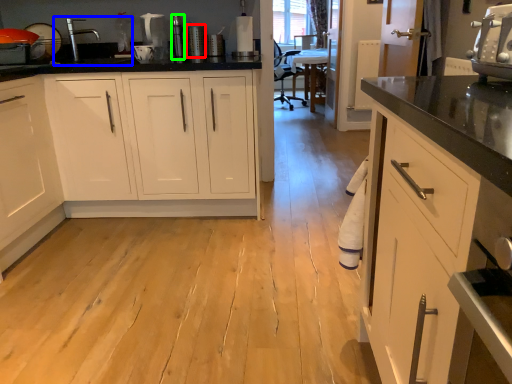
Question: Which object is the closest to the appliance (highlighted by a red box)? Choose among these: sink (highlighted by a blue box) or appliance (highlighted by a green box).

Choices:
 (A) sink
 (B) appliance

Answer: (B)